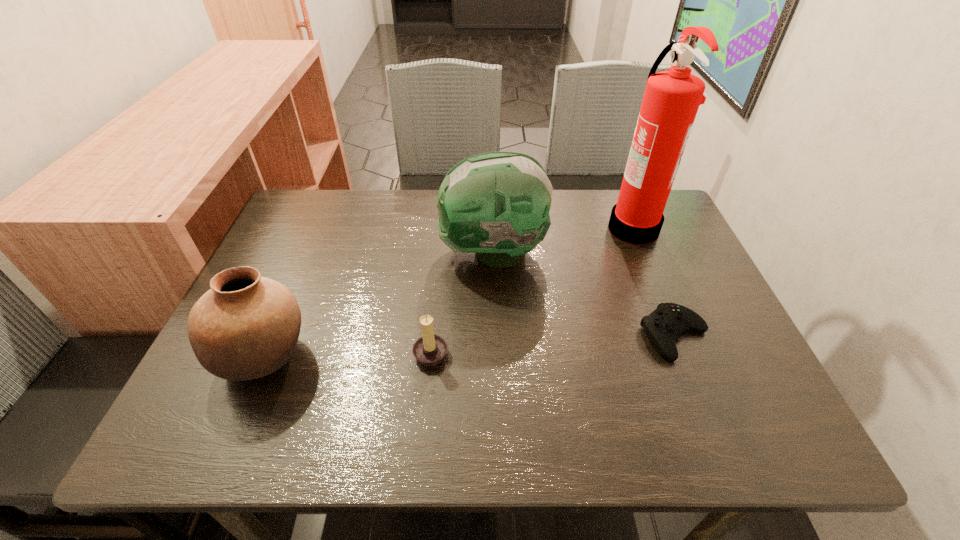
At what (x,y) coordinates should I click in order to perform the action: click on vacant area that lies between the control and the football helmet. Please return your answer as a coordinate pair (x, y). This screenshot has width=960, height=540. Looking at the image, I should click on (584, 294).

Find the location of a particular element. The width and height of the screenshot is (960, 540). blank region between the leftmost object and the second tallest object is located at coordinates (378, 304).

Where is `free space between the second tallest object and the shortest object`? Image resolution: width=960 pixels, height=540 pixels. free space between the second tallest object and the shortest object is located at coordinates pos(584,294).

Where is `vacant region between the football helmet and the leftmost object`? The image size is (960, 540). vacant region between the football helmet and the leftmost object is located at coordinates (378, 304).

Locate an element on the screen. free spot between the third shortest object and the football helmet is located at coordinates (378, 304).

The height and width of the screenshot is (540, 960). In order to click on empty location between the pottery and the candle holder in this screenshot , I will do `click(348, 354)`.

Choose which object is the third nearest neighbor to the shortest object. Please provide its 2D coordinates. Your answer should be formatted as a tuple, i.e. [(x, y)], where the tuple contains the x and y coordinates of a point satisfying the conditions above.

[(430, 349)]

Locate an element on the screen. This screenshot has width=960, height=540. object that ranks as the fourth closest to the fire extinguisher is located at coordinates (245, 327).